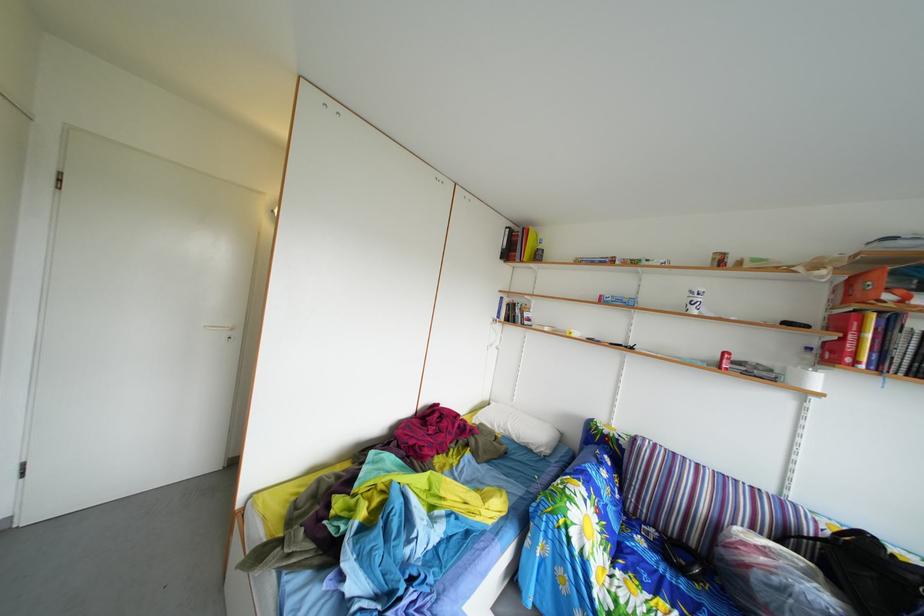
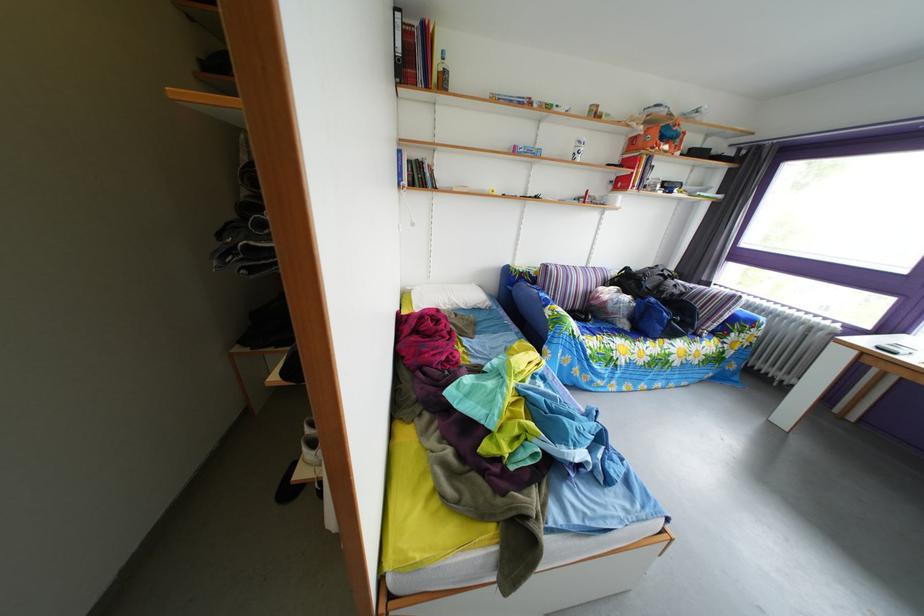
Where in the second image is the point corresponding to point (795, 495) from the first image?

(599, 270)